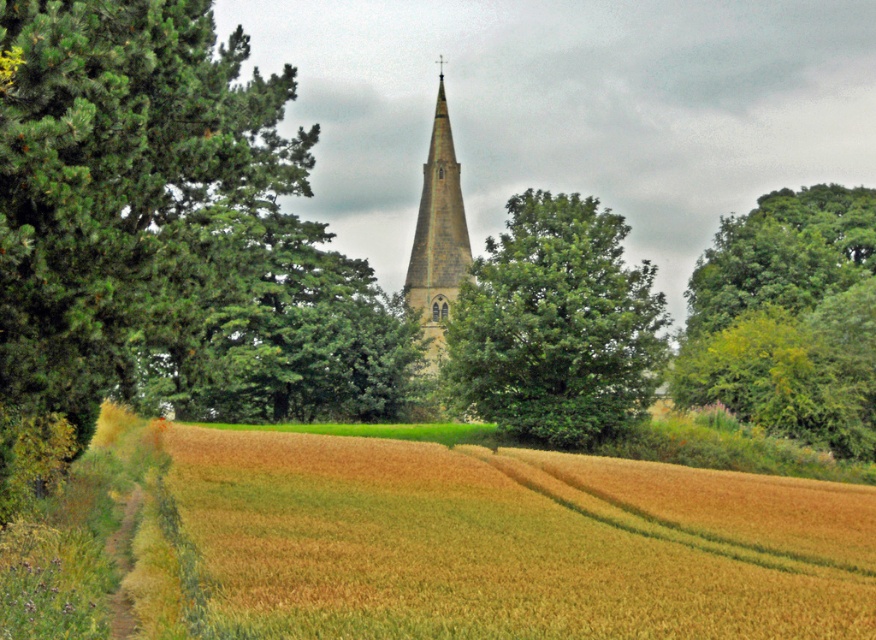
You are standing in the field of golden crops and want to take a photo of the light brown stone steeple at center. However, the green leafy tree at center is blocking your view. Can you estimate if the tree is smaller than the steeple in the image?

The green leafy tree at center occupies less space than light brown stone steeple at center, so yes, the tree is smaller than the steeple in the image.

You are standing in the middle of the field of golden crops and see the green leafy tree at center and the light brown stone steeple at center. Which object is located to the right of the other?

The green leafy tree at center is positioned on the right side of light brown stone steeple at center.

You are a farmer standing at the edge of the golden wheat field at lower left and the green leafy tree at center. You want to plant a row of sunflowers between them. Which area has more space to accommodate the sunflowers?

The golden wheat field at lower left has a larger width than the green leafy tree at center, so it has more space to accommodate the sunflowers.